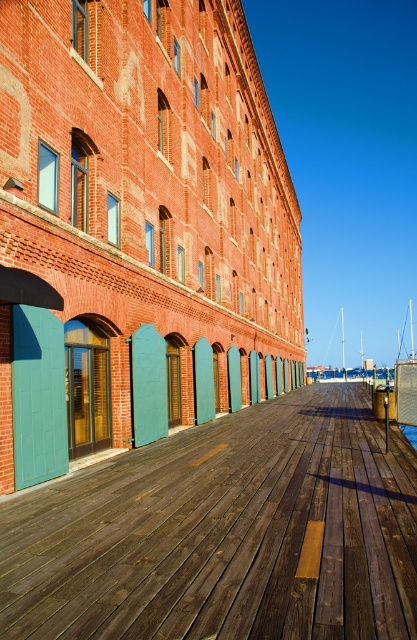
Question: Which of the following is the farthest from the observer?

Choices:
 (A) (414, 432)
 (B) (371, 547)

Answer: (A)

Question: Can you confirm if white sailboat at center is thinner than blue water at lower center?

Choices:
 (A) yes
 (B) no

Answer: (B)

Question: Is wooden dock at center above blue water at lower center?

Choices:
 (A) no
 (B) yes

Answer: (B)

Question: Considering the real-world distances, which object is farthest from the wooden dock at center?

Choices:
 (A) blue water at lower center
 (B) white sailboat at center

Answer: (B)

Question: Is white sailboat at center above blue water at lower center?

Choices:
 (A) yes
 (B) no

Answer: (B)

Question: Which object is farther from the camera taking this photo?

Choices:
 (A) wooden dock at center
 (B) white sailboat at center

Answer: (B)